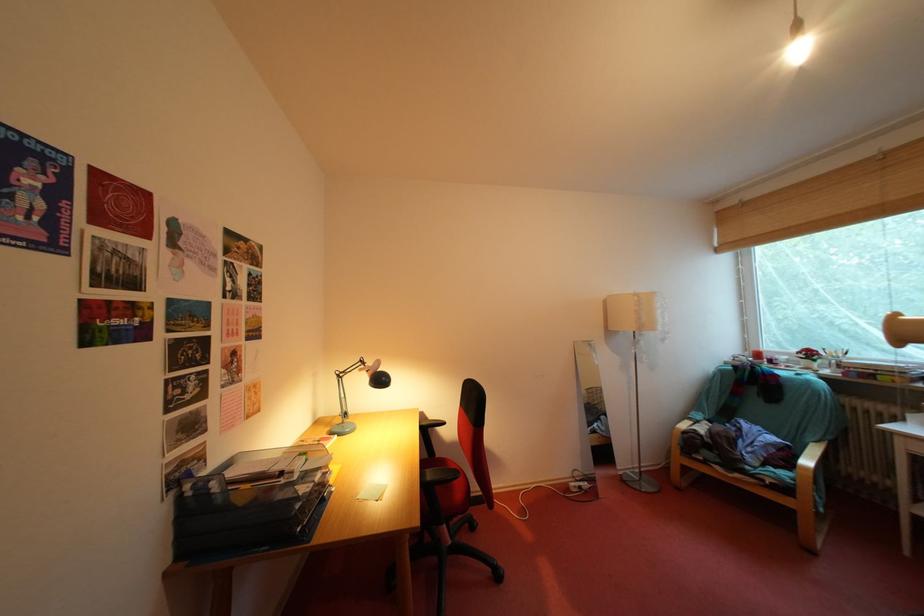
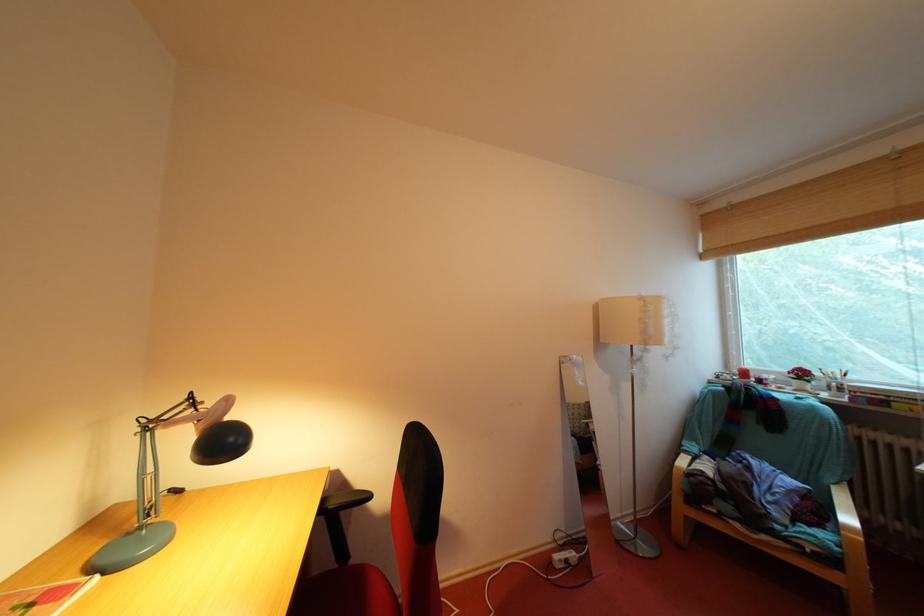
Find the pixel in the second image that matches (x=436, y=461) in the first image.

(342, 569)